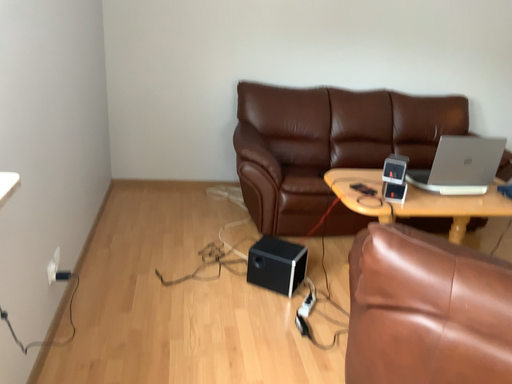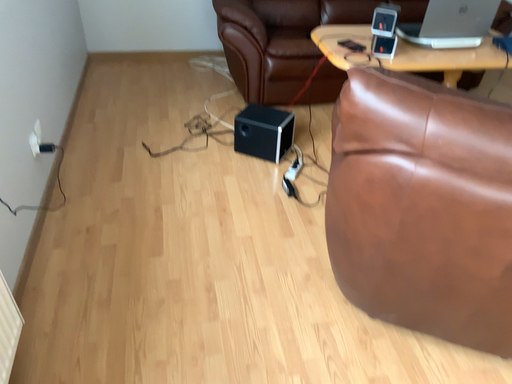
Question: How did the camera likely rotate when shooting the video?

Choices:
 (A) rotated upward
 (B) rotated downward

Answer: (B)